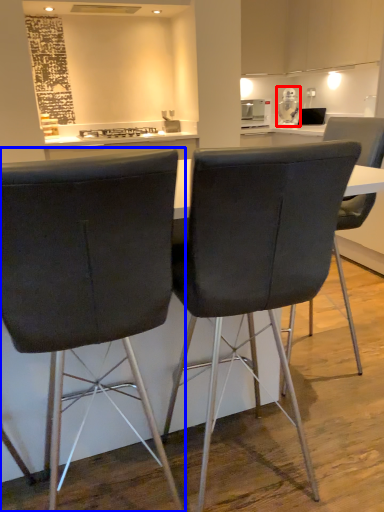
Question: Which point is closer to the camera, appliance (highlighted by a red box) or chair (highlighted by a blue box)?

Choices:
 (A) appliance
 (B) chair

Answer: (B)